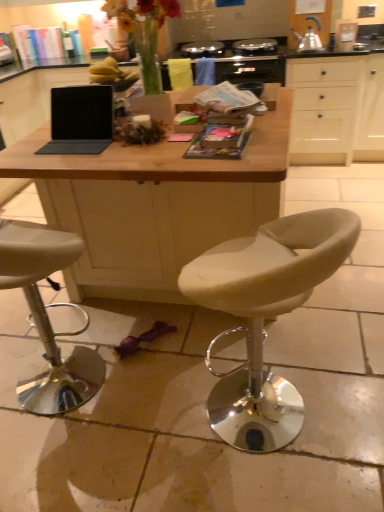
The width and height of the screenshot is (384, 512). Identify the location of vacant area that is in front of beige leather stool at lower left, which ranks as the second chair in right-to-left order. (66, 470).